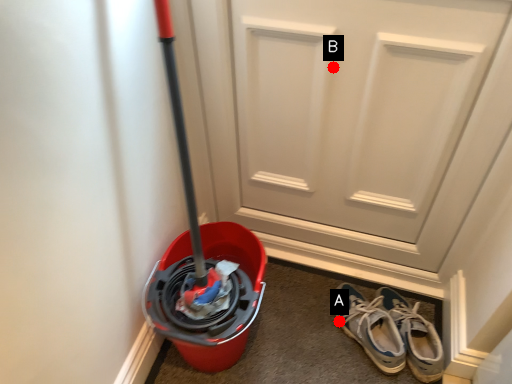
Question: Two points are circled on the image, labeled by A and B beside each circle. Which point is closer to the camera taking this photo?

Choices:
 (A) A is closer
 (B) B is closer

Answer: (B)